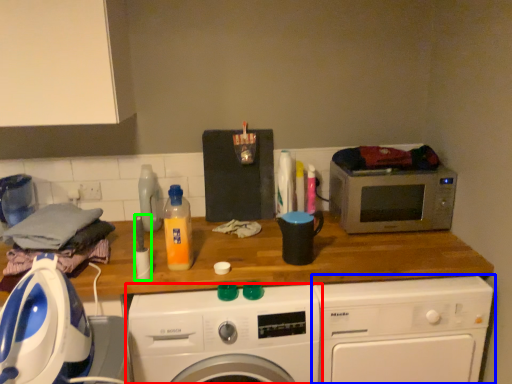
Question: Considering the real-world distances, which object is closest to washing machine (highlighted by a red box)? washing machine (highlighted by a blue box) or appliance (highlighted by a green box).

Choices:
 (A) washing machine
 (B) appliance

Answer: (A)